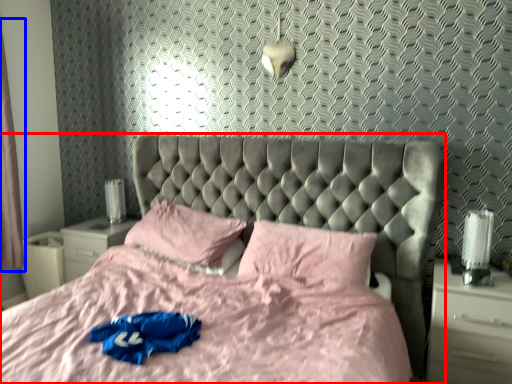
Question: Which of the following is the closest to the observer, bed (highlighted by a red box) or curtain (highlighted by a blue box)?

Choices:
 (A) bed
 (B) curtain

Answer: (A)